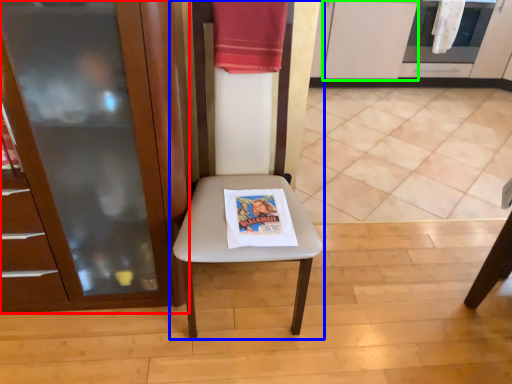
Question: Considering the real-world distances, which object is closest to cabinetry (highlighted by a red box)? chair (highlighted by a blue box) or cabinetry (highlighted by a green box).

Choices:
 (A) chair
 (B) cabinetry

Answer: (A)